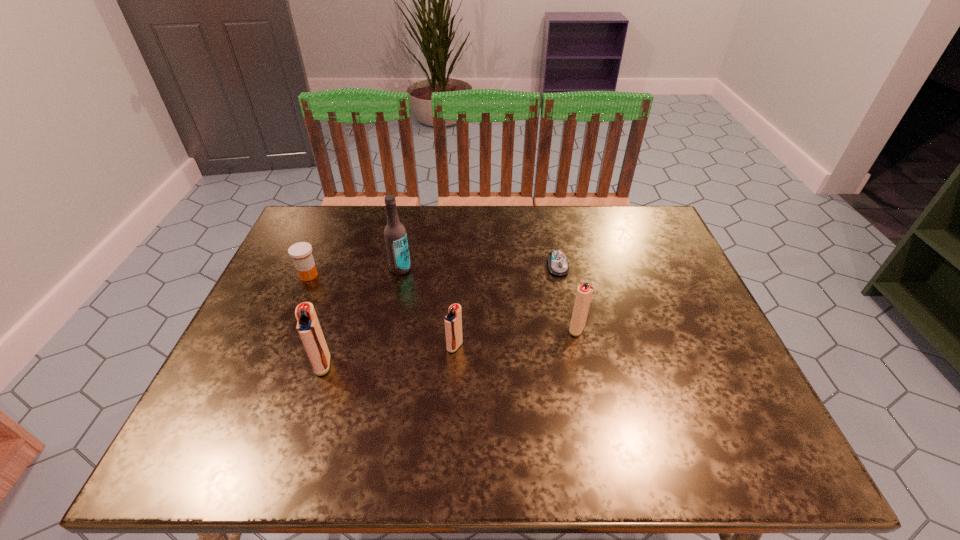
The image size is (960, 540). Find the location of `vacant area at the right edge`. vacant area at the right edge is located at coordinates (707, 330).

Where is `free location at the far right corner`? The height and width of the screenshot is (540, 960). free location at the far right corner is located at coordinates (625, 210).

Image resolution: width=960 pixels, height=540 pixels. In the image, there is a desktop. What are the coordinates of `vacant space at the near right corner` in the screenshot? It's located at (685, 408).

Locate an element on the screen. This screenshot has height=540, width=960. empty location between the third tallest object and the third object from left to right is located at coordinates (489, 299).

I want to click on vacant area that lies between the beer bottle and the shortest object, so click(x=479, y=267).

Locate an element on the screen. The image size is (960, 540). vacant area between the shortest object and the leftmost object is located at coordinates (433, 271).

Identify the location of free space between the medicine and the farthest igniter. (443, 302).

Where is `vacant area between the computer mouse and the leftmost igniter`? Image resolution: width=960 pixels, height=540 pixels. vacant area between the computer mouse and the leftmost igniter is located at coordinates (441, 315).

Find the location of a particular element. The width and height of the screenshot is (960, 540). free space between the second shortest object and the third object from right to left is located at coordinates (382, 310).

This screenshot has width=960, height=540. In order to click on vacant region between the shortest object and the leftmost igniter in this screenshot , I will do `click(441, 315)`.